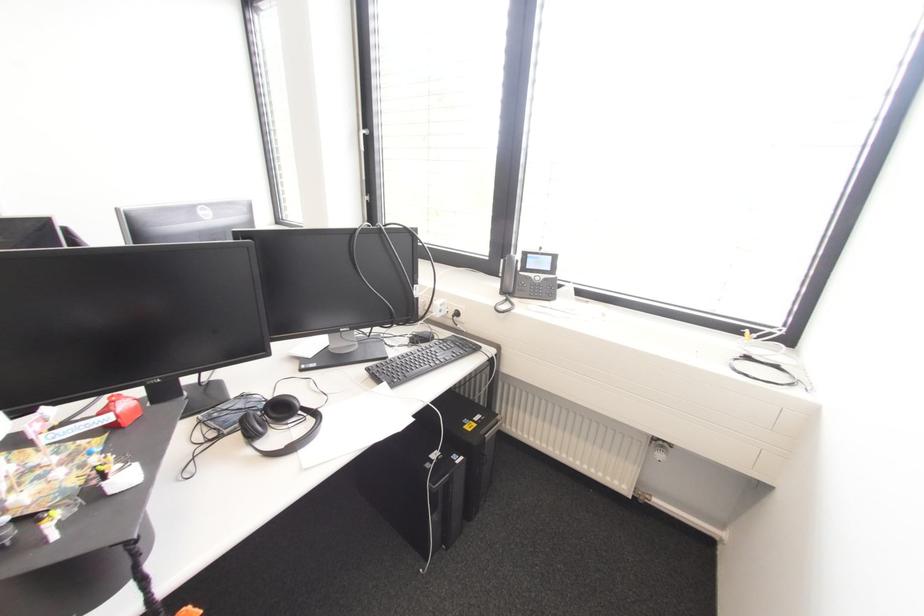
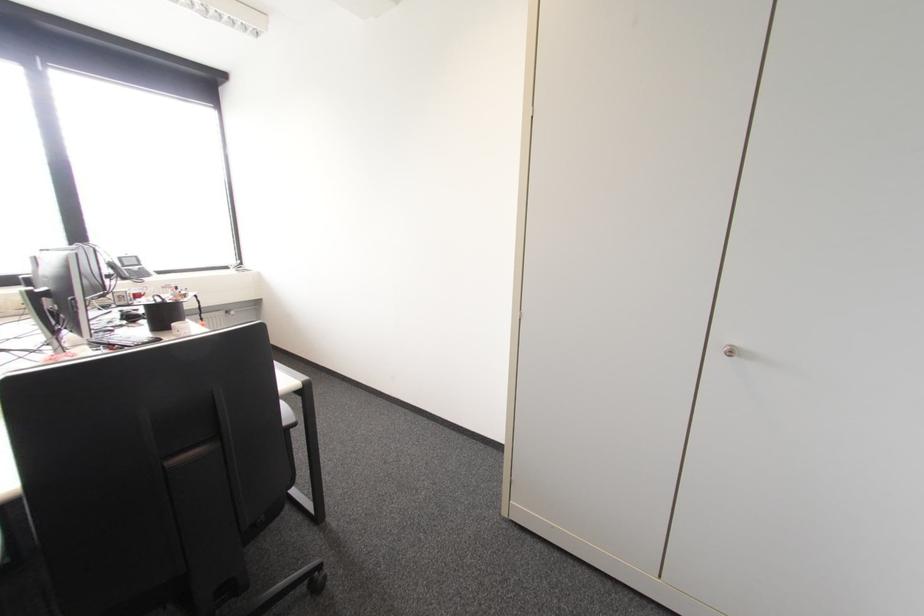
Find the pixel in the second image that matches point 503,292 in the first image.

(123, 278)